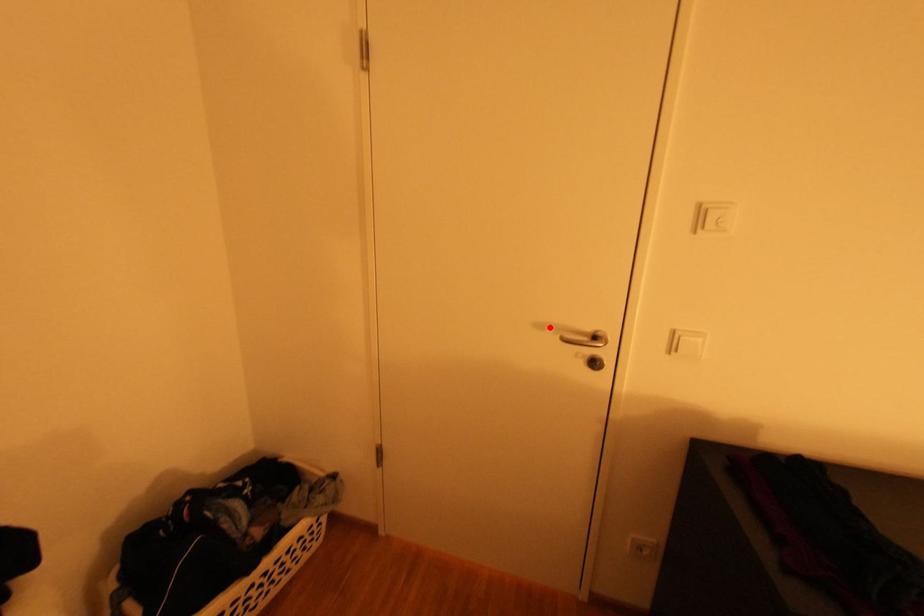
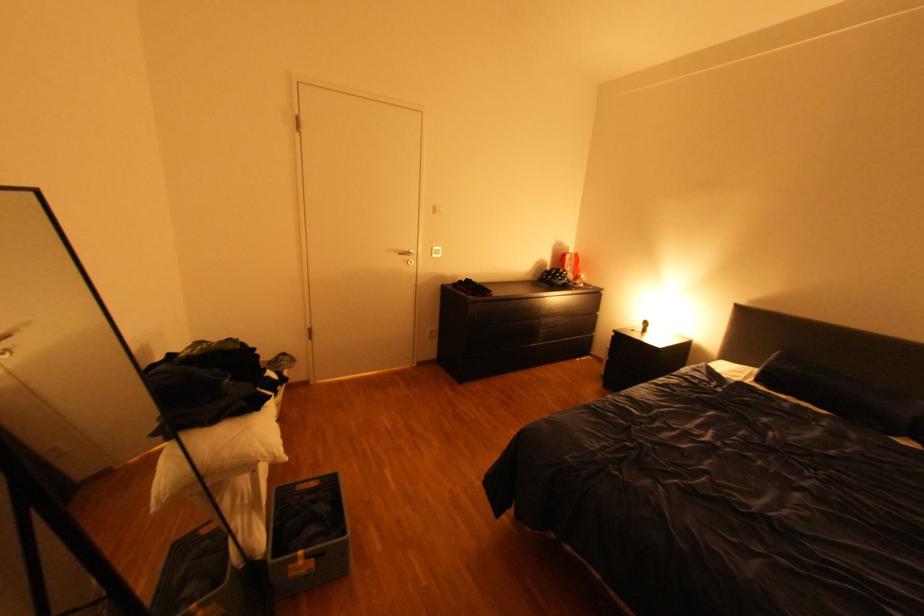
The point at the highlighted location is marked in the first image. Where is the corresponding point in the second image?

(399, 249)